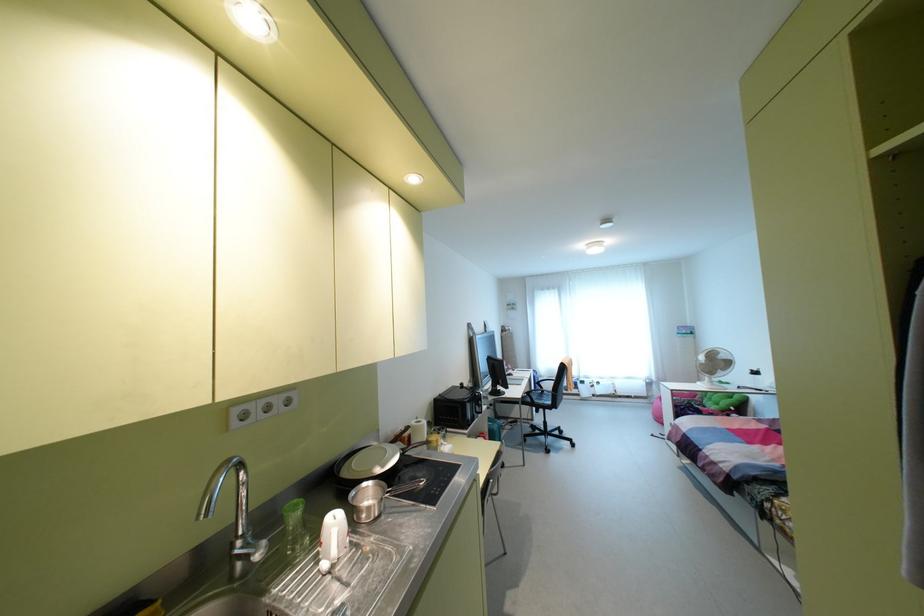
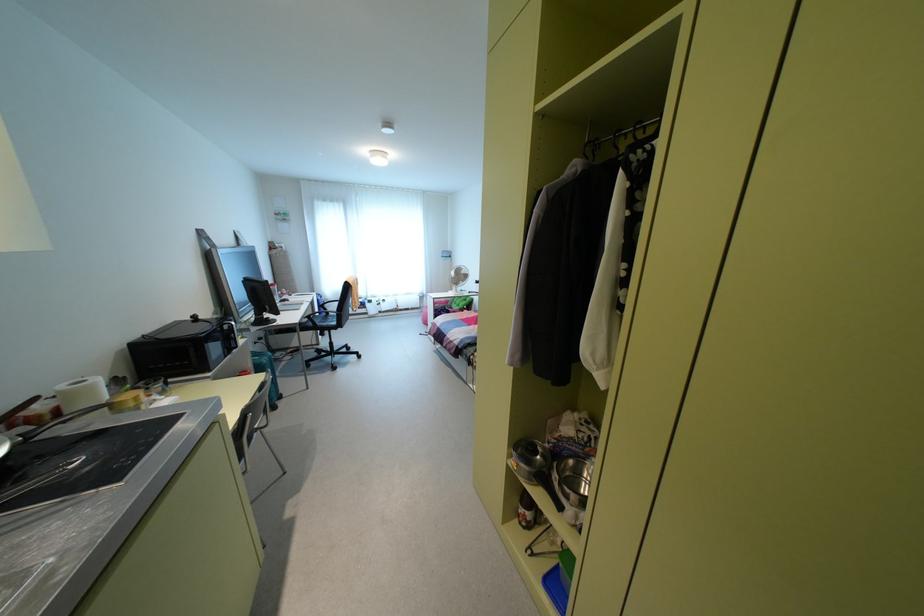
Where in the second image is the point corresponding to (x=528, y=392) from the first image?

(309, 315)